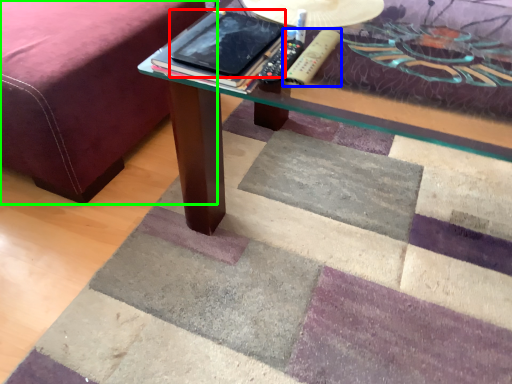
Question: Which is nearer to the tablet computer (highlighted by a red box)? remote (highlighted by a blue box) or bed frame (highlighted by a green box).

Choices:
 (A) remote
 (B) bed frame

Answer: (A)